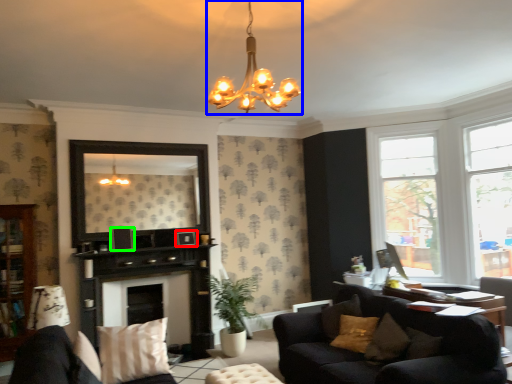
Question: Which object is positioned closest to picture frame (highlighted by a red box)? Select from lamp (highlighted by a blue box) and picture frame (highlighted by a green box).

Choices:
 (A) lamp
 (B) picture frame

Answer: (B)